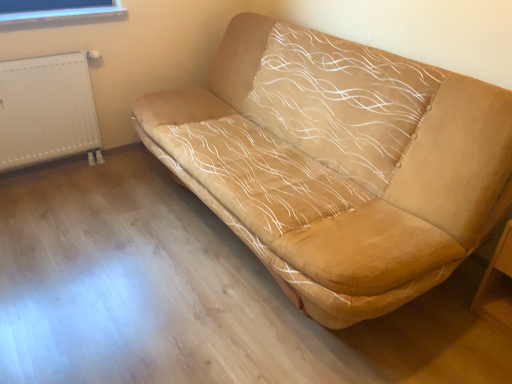
Question: Could you tell me if suede-like beige sofa at center is facing white plastic radiator at left?

Choices:
 (A) yes
 (B) no

Answer: (A)

Question: Can you confirm if suede-like beige sofa at center is shorter than white plastic radiator at left?

Choices:
 (A) yes
 (B) no

Answer: (B)

Question: Considering the relative sizes of suede-like beige sofa at center and white plastic radiator at left in the image provided, is suede-like beige sofa at center bigger than white plastic radiator at left?

Choices:
 (A) yes
 (B) no

Answer: (A)

Question: Can you confirm if suede-like beige sofa at center is wider than white plastic radiator at left?

Choices:
 (A) yes
 (B) no

Answer: (A)

Question: Considering the relative positions of suede-like beige sofa at center and white plastic radiator at left in the image provided, is suede-like beige sofa at center to the right of white plastic radiator at left from the viewer's perspective?

Choices:
 (A) no
 (B) yes

Answer: (B)

Question: Is suede-like beige sofa at center closer to camera compared to white plastic radiator at left?

Choices:
 (A) no
 (B) yes

Answer: (B)

Question: Does white plastic radiator at left have a greater height compared to suede-like beige sofa at center?

Choices:
 (A) yes
 (B) no

Answer: (B)

Question: Considering the relative sizes of white plastic radiator at left and suede-like beige sofa at center in the image provided, is white plastic radiator at left wider than suede-like beige sofa at center?

Choices:
 (A) no
 (B) yes

Answer: (A)

Question: From a real-world perspective, is white plastic radiator at left positioned under suede-like beige sofa at center based on gravity?

Choices:
 (A) yes
 (B) no

Answer: (A)

Question: Does white plastic radiator at left have a larger size compared to suede-like beige sofa at center?

Choices:
 (A) yes
 (B) no

Answer: (B)

Question: Is white plastic radiator at left with suede-like beige sofa at center?

Choices:
 (A) no
 (B) yes

Answer: (A)

Question: Considering the relative sizes of white plastic radiator at left and suede-like beige sofa at center in the image provided, is white plastic radiator at left smaller than suede-like beige sofa at center?

Choices:
 (A) yes
 (B) no

Answer: (A)

Question: Does wooden table at lower right turn towards white plastic radiator at left?

Choices:
 (A) no
 (B) yes

Answer: (A)